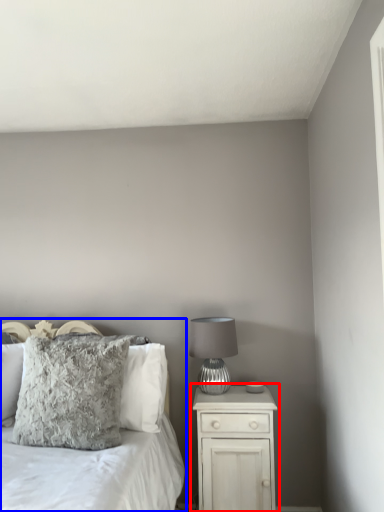
Question: Which object is further to the camera taking this photo, nightstand (highlighted by a red box) or bed (highlighted by a blue box)?

Choices:
 (A) nightstand
 (B) bed

Answer: (A)